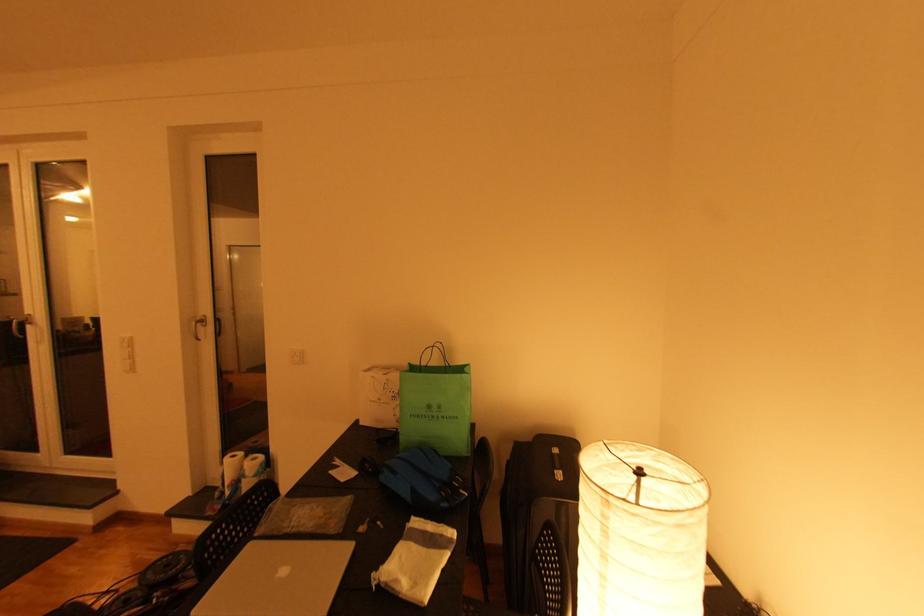
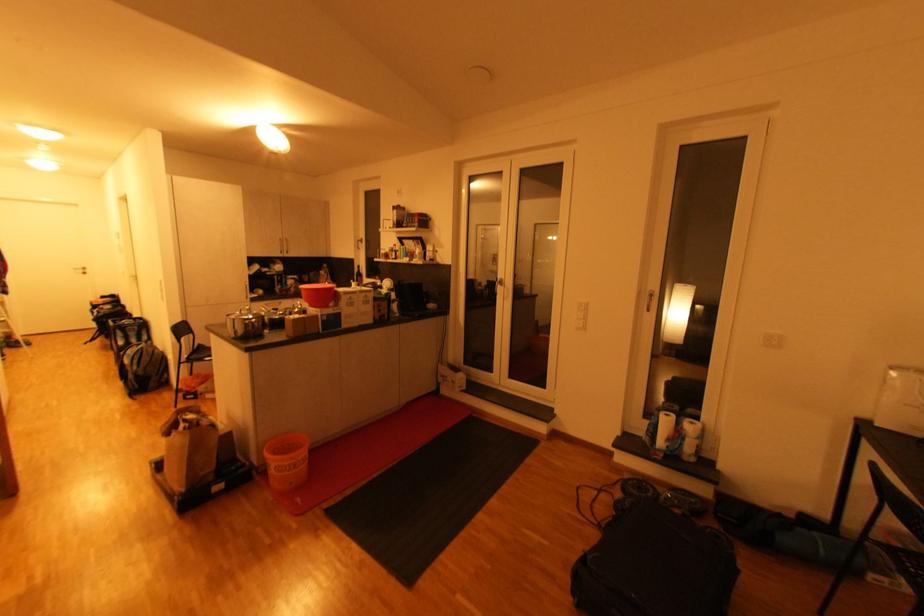
The point at (259, 459) is marked in the first image. Where is the corresponding point in the second image?

(698, 424)